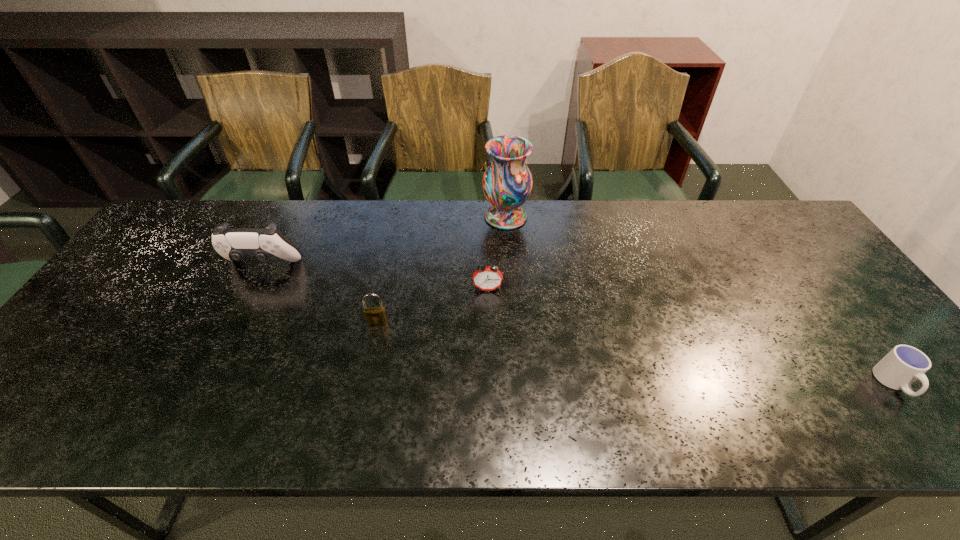
The width and height of the screenshot is (960, 540). What are the coordinates of `blank space at the right edge of the desktop` in the screenshot? It's located at [x=819, y=294].

Identify the location of free location at the near left corner. (31, 403).

Locate an element on the screen. The image size is (960, 540). free space between the leftmost object and the padlock is located at coordinates (320, 294).

Find the location of a particular element. The height and width of the screenshot is (540, 960). free area in between the cup and the farthest object is located at coordinates (700, 300).

Identify the location of vacant area between the leftmost object and the fourth object from right to left. (320, 294).

You are a GUI agent. You are given a task and a screenshot of the screen. Output one action in this format:
    pyautogui.click(x=<x>, y=<y>)
    Task: Click on the vacant area between the control and the third farthest object
    The height and width of the screenshot is (540, 960).
    Given the screenshot: What is the action you would take?
    pyautogui.click(x=375, y=277)

Where is `unoccupied area between the tallest object and the nearest object`? The width and height of the screenshot is (960, 540). unoccupied area between the tallest object and the nearest object is located at coordinates (700, 300).

You are a GUI agent. You are given a task and a screenshot of the screen. Output one action in this format:
    pyautogui.click(x=<x>, y=<y>)
    Task: Click on the free space between the fourth farthest object and the tallest object
    The width and height of the screenshot is (960, 540).
    Given the screenshot: What is the action you would take?
    pyautogui.click(x=442, y=269)

Identify the location of free point between the vase and the second object from left to right. (442, 269).

In order to click on free area in between the fourth shortest object and the fourth object from right to left in this screenshot , I will do `click(320, 294)`.